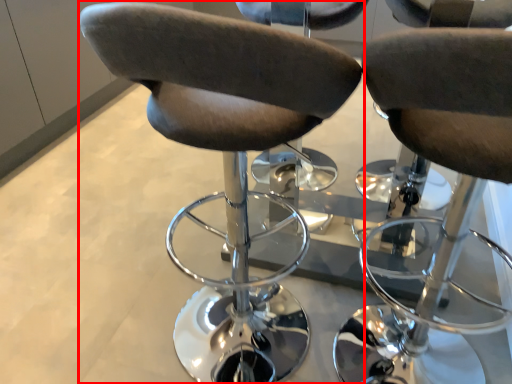
Question: Where is chair (annotated by the red box) located in relation to chair in the image?

Choices:
 (A) right
 (B) left

Answer: (B)